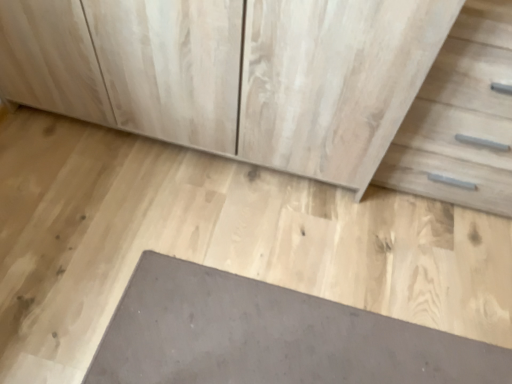
Image resolution: width=512 pixels, height=384 pixels. I want to click on vacant space behind slate at lower center, so click(312, 234).